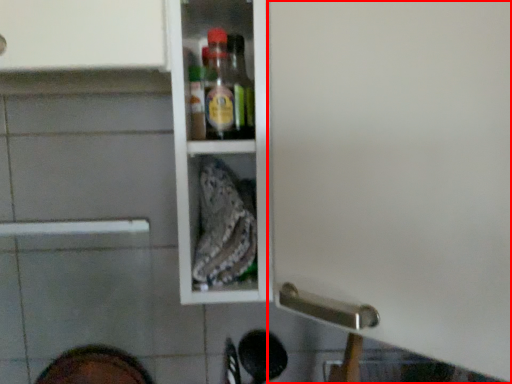
Question: From the image's perspective, what is the correct spatial positioning of screen door (annotated by the red box) in reference to footwear?

Choices:
 (A) above
 (B) below

Answer: (A)